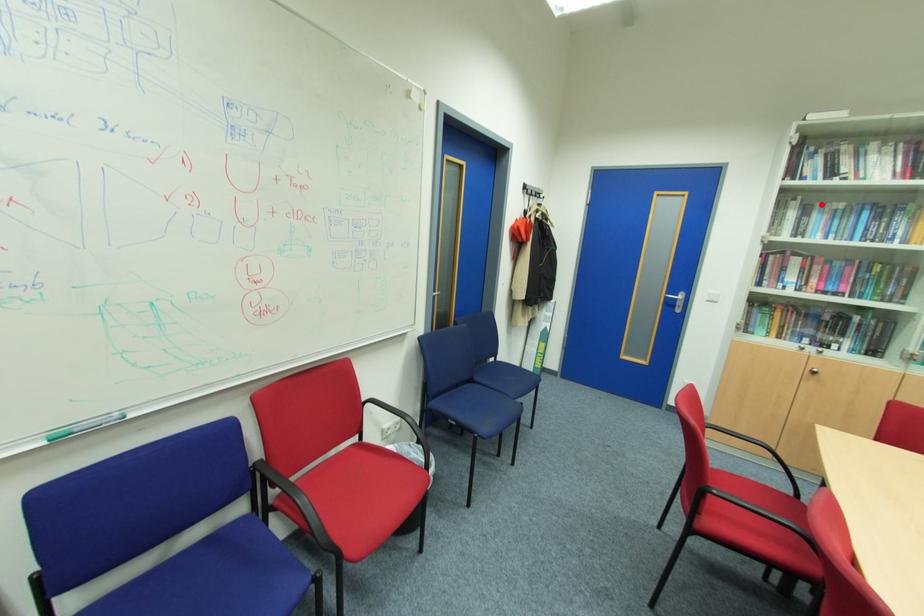
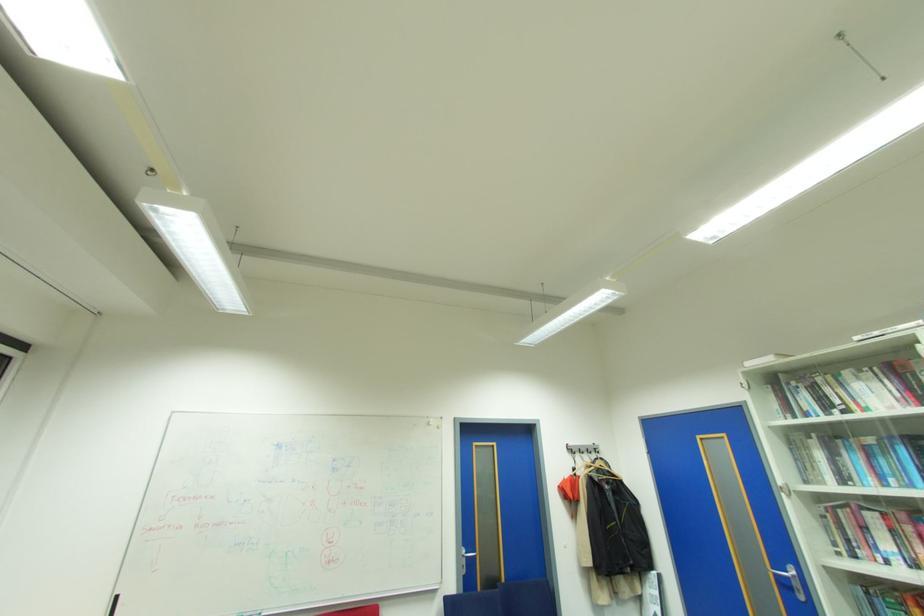
Where in the second image is the point corresponding to the highlighted location from the first image?

(843, 442)